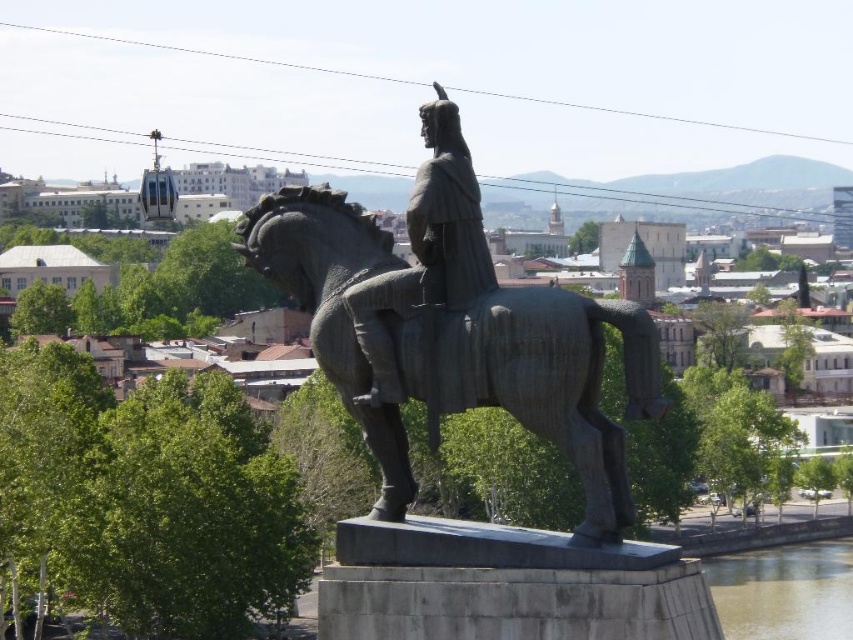
You are an artist planning to sketch the statue and its surroundings. You need to decide which area to focus on first based on their sizes. Which object is wider between the bronze textured horse at center and the brown murky water at lower right?

The brown murky water at lower right is wider than the bronze textured horse at center.

You are a tour guide explaining the statue to visitors. You mention that the bronze textured horse at center and bronze statue at center are part of the same artwork. Which one is positioned to the right of the other?

The bronze textured horse at center is positioned to the right of bronze statue at center.

You are a tour guide explaining the statue and its surroundings to visitors. Pointing to the bronze textured horse at center and the brown murky water at lower right, you want to mention their relative sizes. How would you describe their height in comparison?

The bronze textured horse at center is taller than the brown murky water at lower right.